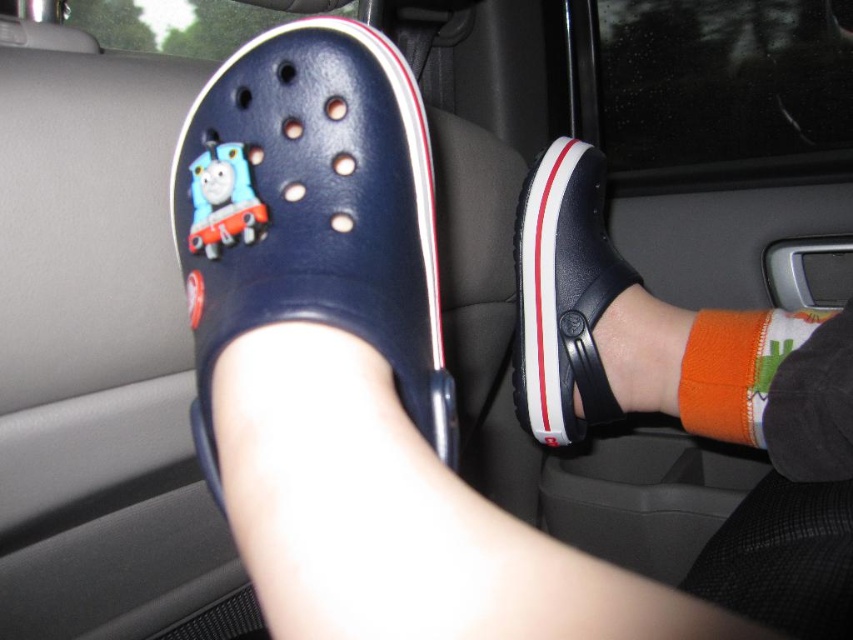
Who is more distant from viewer, (x=677, y=410) or (x=218, y=211)?

The point (x=677, y=410) is more distant.

Does matte black croc at center have a greater width compared to blue matte thomas the tank engine at left?

Yes, matte black croc at center is wider than blue matte thomas the tank engine at left.

Which is in front, point (537, 387) or point (262, 221)?

Point (262, 221) is in front.

The height and width of the screenshot is (640, 853). I want to click on matte black croc at center, so click(x=664, y=340).

In the scene shown: Who is positioned more to the right, orange knitted sock at lower right or blue matte thomas the tank engine at left?

Positioned to the right is orange knitted sock at lower right.

Describe the element at coordinates (737, 369) in the screenshot. I see `orange knitted sock at lower right` at that location.

At what (x,y) coordinates should I click in order to perform the action: click on orange knitted sock at lower right. Please return your answer as a coordinate pair (x, y). The height and width of the screenshot is (640, 853). Looking at the image, I should click on (737, 369).

Who is more distant from viewer, (809,380) or (613,276)?

Point (613,276)

Can you confirm if matte black croc at center is thinner than black rubber sandal at center?

No.

Describe the element at coordinates (664, 340) in the screenshot. I see `matte black croc at center` at that location.

Where is `matte black croc at center`? This screenshot has height=640, width=853. matte black croc at center is located at coordinates (664, 340).